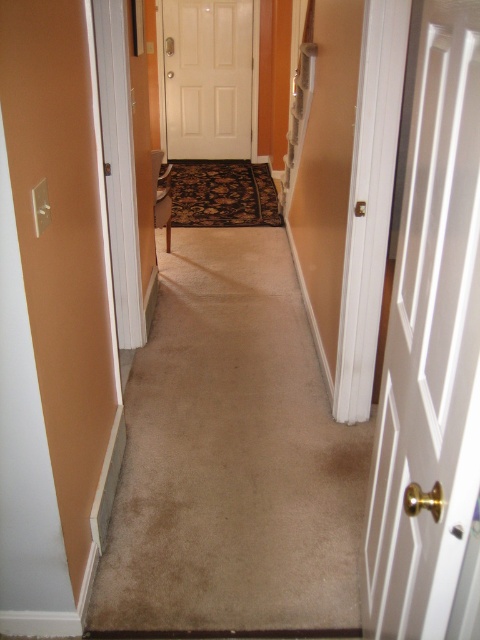
Who is higher up, white wood door at right or white matte door at center?

white matte door at center is above.

Is point (456, 332) farther from viewer compared to point (176, 109)?

That is False.

At what (x,y) coordinates should I click in order to perform the action: click on white wood door at right. Please return your answer as a coordinate pair (x, y). Looking at the image, I should click on (430, 348).

This screenshot has height=640, width=480. What are the coordinates of `white wood door at right` in the screenshot? It's located at coord(430,348).